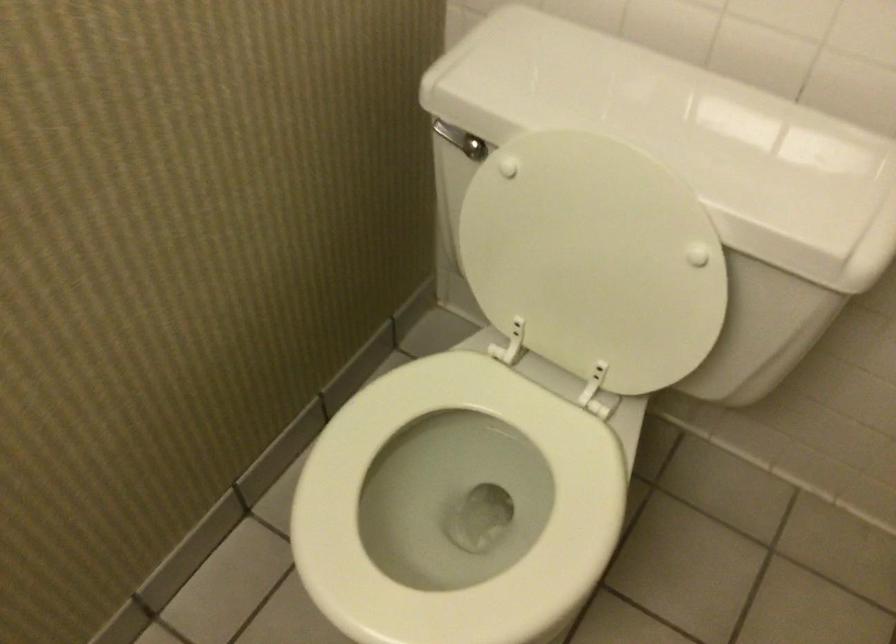
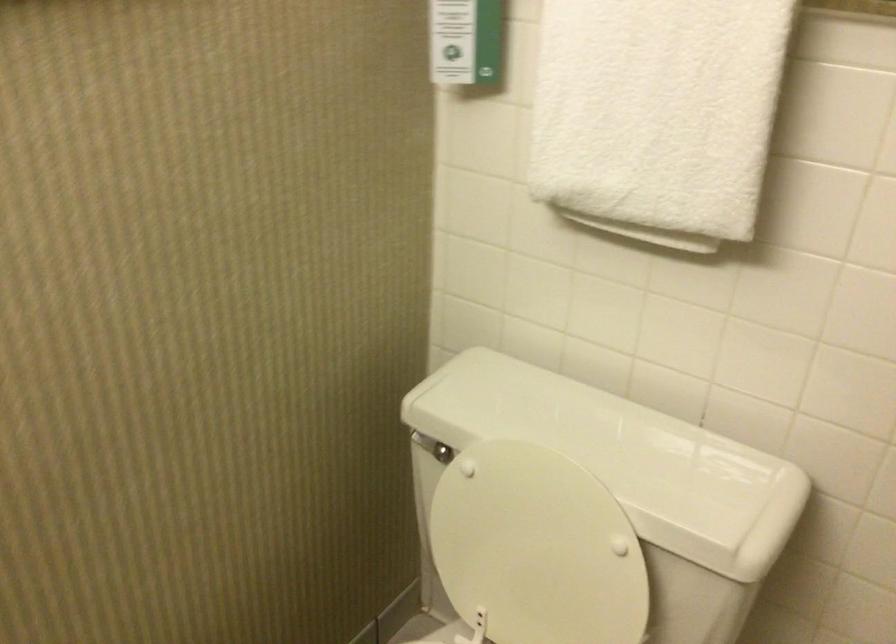
Where in the second image is the point corresponding to [590,254] from the first image?

(536, 547)